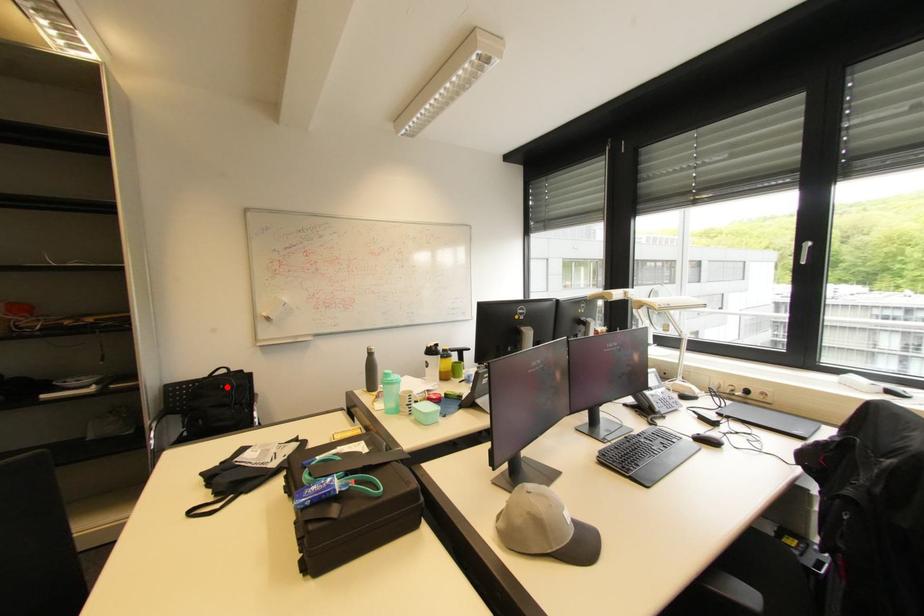
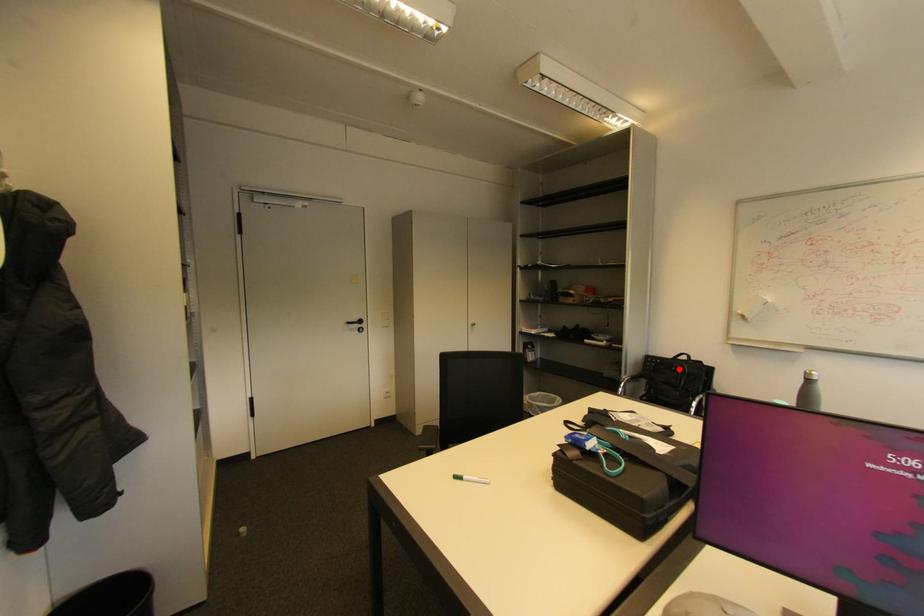
I am providing you with two images of the same scene from different viewpoints. A red point is marked on the first image and another point is marked on the second image. Does the point marked in image1 correspond to the same location as the one in image2?

Yes